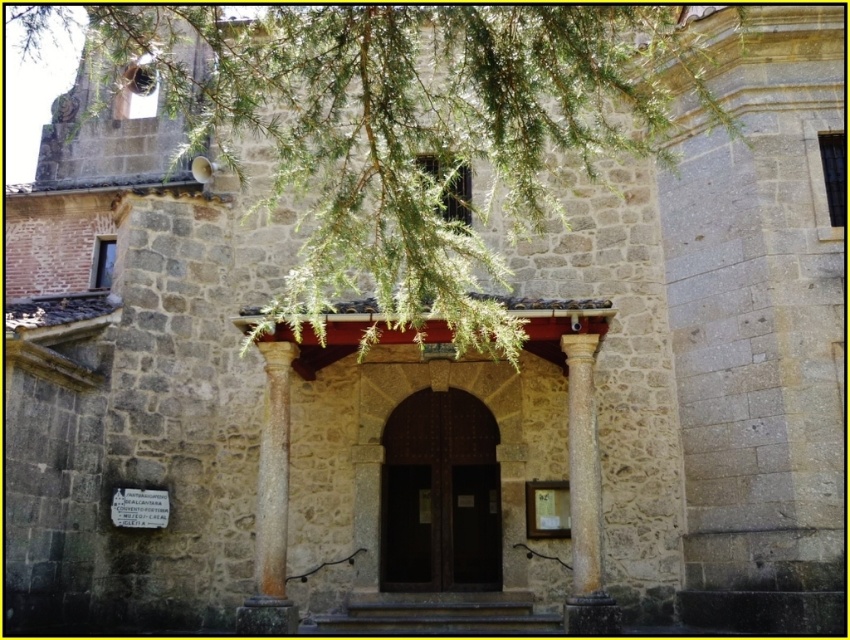
The width and height of the screenshot is (850, 640). What do you see at coordinates (439, 493) in the screenshot?
I see `dark wood door at center` at bounding box center [439, 493].

Is dark wood door at center positioned in front of smooth stone column at center?

No, it is behind smooth stone column at center.

You are a GUI agent. You are given a task and a screenshot of the screen. Output one action in this format:
    pyautogui.click(x=<x>, y=<y>)
    Task: Click on the dark wood door at center
    This screenshot has height=640, width=850.
    Given the screenshot: What is the action you would take?
    pyautogui.click(x=439, y=493)

Is green leafy branch at upper center thinner than sandy brown stone column at center?

In fact, green leafy branch at upper center might be wider than sandy brown stone column at center.

You are a GUI agent. You are given a task and a screenshot of the screen. Output one action in this format:
    pyautogui.click(x=<x>, y=<y>)
    Task: Click on the green leafy branch at upper center
    The image size is (850, 640).
    Given the screenshot: What is the action you would take?
    pyautogui.click(x=406, y=129)

The image size is (850, 640). Identify the location of green leafy branch at upper center. (406, 129).

Is green leafy branch at upper center shorter than smooth stone column at center?

No.

This screenshot has width=850, height=640. Find the location of `green leafy branch at upper center`. green leafy branch at upper center is located at coordinates (406, 129).